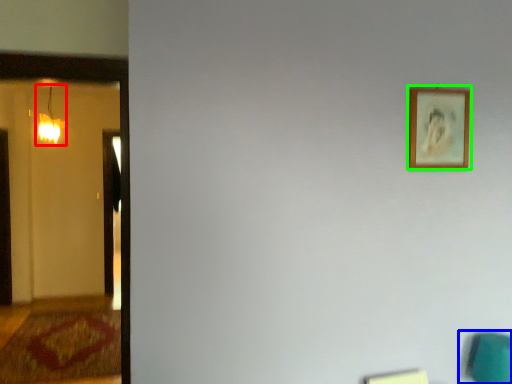
Question: Which object is the closest to the lamp (highlighted by a red box)? Choose among these: swivel chair (highlighted by a blue box) or picture frame (highlighted by a green box).

Choices:
 (A) swivel chair
 (B) picture frame

Answer: (B)